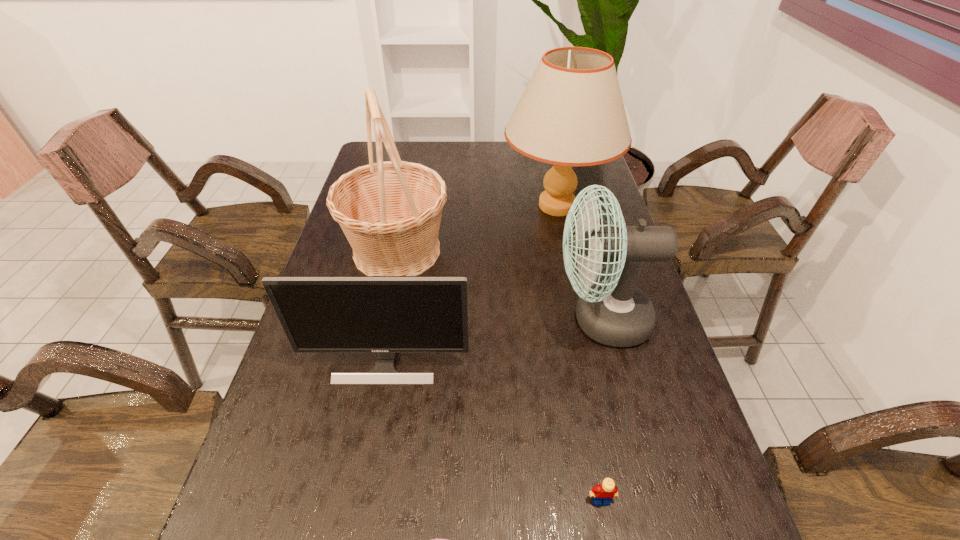
Locate an element on the screen. The width and height of the screenshot is (960, 540). vacant region located 0.230m in front of the fan where the airflow is directed is located at coordinates (461, 319).

Where is `vacant space located 0.240m on the screen side of the monitor`? vacant space located 0.240m on the screen side of the monitor is located at coordinates (361, 500).

Locate an element on the screen. The image size is (960, 540). vacant point located 0.050m on the front-facing side of the fifth farthest object is located at coordinates (608, 537).

The height and width of the screenshot is (540, 960). What are the coordinates of `basket present at the left edge` in the screenshot? It's located at (390, 212).

This screenshot has height=540, width=960. What are the coordinates of `monitor that is positioned at the left edge` in the screenshot? It's located at (386, 315).

Find the location of a particular element. The width and height of the screenshot is (960, 540). lampshade situated at the right edge is located at coordinates (571, 113).

Locate an element on the screen. fan located at the right edge is located at coordinates (615, 312).

Find the location of a particular element. vacant region at the far edge of the desktop is located at coordinates (510, 151).

In the image, there is a desktop. Where is `vacant region at the left edge`? The height and width of the screenshot is (540, 960). vacant region at the left edge is located at coordinates (276, 392).

Locate an element on the screen. vacant space at the right edge of the desktop is located at coordinates (704, 516).